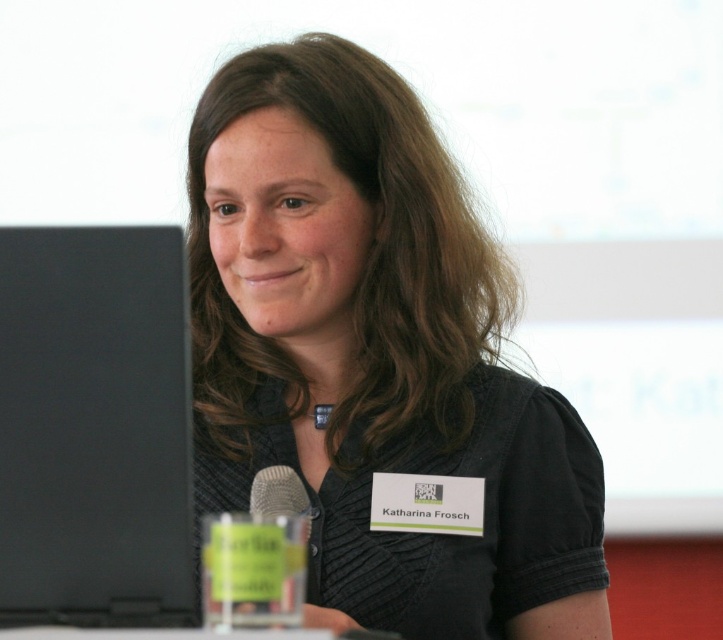
Question: Observing the image, what is the correct spatial positioning of black matte shirt at center in reference to silver metallic microphone at lower left?

Choices:
 (A) above
 (B) below

Answer: (A)

Question: Among these points, which one is nearest to the camera?

Choices:
 (A) (440, 374)
 (B) (93, 509)
 (C) (257, 480)

Answer: (B)

Question: Does black matte shirt at center appear on the right side of silver metallic microphone at lower left?

Choices:
 (A) yes
 (B) no

Answer: (A)

Question: Observing the image, what is the correct spatial positioning of black matte shirt at center in reference to silver metallic microphone at lower left?

Choices:
 (A) below
 (B) above

Answer: (B)

Question: Which point is farther from the camera taking this photo?

Choices:
 (A) (12, 618)
 (B) (281, 477)

Answer: (B)

Question: Which of the following is the farthest from the observer?

Choices:
 (A) black matte shirt at center
 (B) silver metallic microphone at lower left
 (C) black matte laptop at left

Answer: (A)